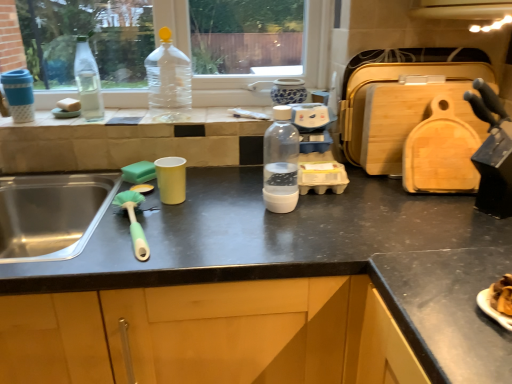
The image size is (512, 384). Identify the location of vacant space in between transparent plastic bottle at center, acting as the 3th bottle starting from the left, and green plastic brush at left. (203, 219).